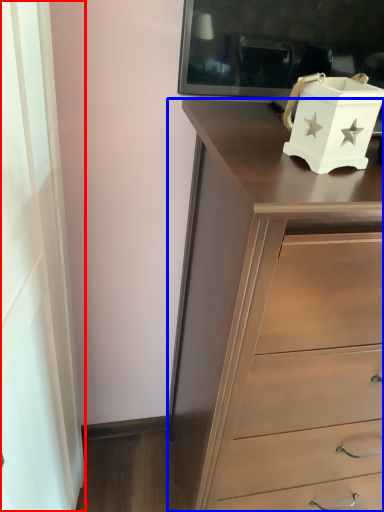
Question: Which object is closer to the camera taking this photo, curtain (highlighted by a red box) or chest of drawers (highlighted by a blue box)?

Choices:
 (A) curtain
 (B) chest of drawers

Answer: (B)